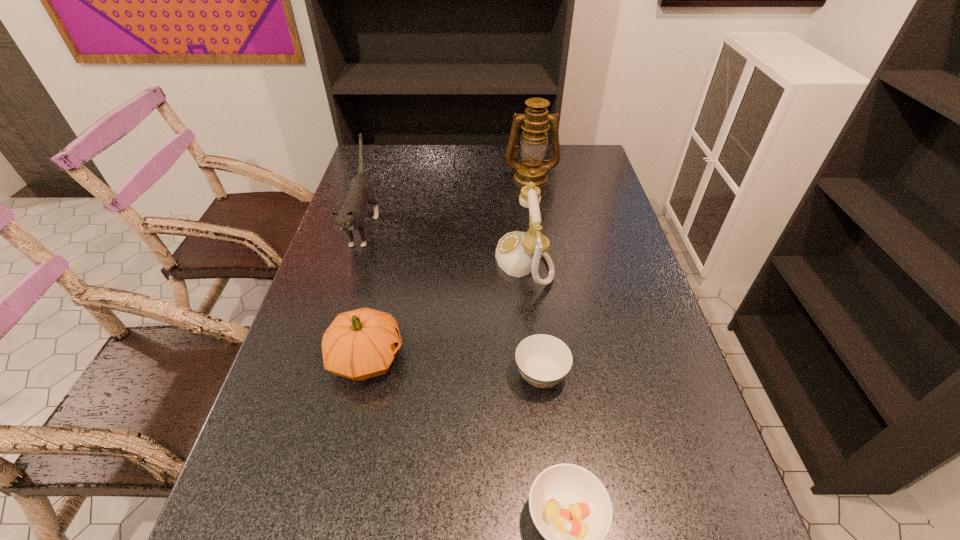
You are a GUI agent. You are given a task and a screenshot of the screen. Output one action in this format:
    pyautogui.click(x=<x>, y=<y>)
    Task: Click on the free region that satisfies the following two spatial constraints: 1. on the side of the farther soup bowl with the carved face; 2. on the left side of the gourd
    This screenshot has width=960, height=540.
    Given the screenshot: What is the action you would take?
    pyautogui.click(x=362, y=375)

Identify the location of vacant area in the image that satisfies the following two spatial constraints: 1. on the dial of the farther soup bowl; 2. on the right side of the third tallest object. Image resolution: width=960 pixels, height=540 pixels. (536, 375).

Find the location of a particular element. This screenshot has height=540, width=960. vacant space that satisfies the following two spatial constraints: 1. on the side of the farther soup bowl with the carved face; 2. on the left side of the gourd is located at coordinates 362,375.

The image size is (960, 540). What are the coordinates of `vacant area that satisfies the following two spatial constraints: 1. on the back side of the farther soup bowl; 2. on the dial of the telephone` in the screenshot? It's located at (527, 260).

At what (x,y) coordinates should I click in order to perform the action: click on free space that satisfies the following two spatial constraints: 1. on the dial of the farther soup bowl; 2. on the right side of the fourth shortest object. Please return your answer as a coordinate pair (x, y). Looking at the image, I should click on (536, 375).